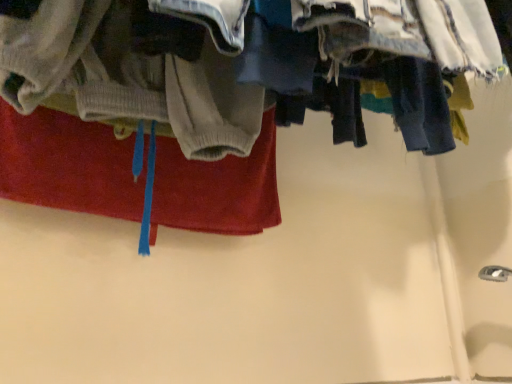
Question: Does denim fabric pants at upper right have a greater width compared to red cotton towel at upper left?

Choices:
 (A) no
 (B) yes

Answer: (B)

Question: Is denim fabric pants at upper right next to red cotton towel at upper left?

Choices:
 (A) yes
 (B) no

Answer: (B)

Question: Considering the relative positions of denim fabric pants at upper right and red cotton towel at upper left in the image provided, is denim fabric pants at upper right in front of red cotton towel at upper left?

Choices:
 (A) yes
 (B) no

Answer: (A)

Question: Does denim fabric pants at upper right have a smaller size compared to red cotton towel at upper left?

Choices:
 (A) no
 (B) yes

Answer: (A)

Question: Does denim fabric pants at upper right have a larger size compared to red cotton towel at upper left?

Choices:
 (A) yes
 (B) no

Answer: (A)

Question: From a real-world perspective, is denim fabric pants at upper right located higher than red cotton towel at upper left?

Choices:
 (A) yes
 (B) no

Answer: (A)

Question: From a real-world perspective, is red cotton towel at upper left under denim fabric pants at upper right?

Choices:
 (A) no
 (B) yes

Answer: (B)

Question: Is the depth of red cotton towel at upper left greater than that of denim fabric pants at upper right?

Choices:
 (A) yes
 (B) no

Answer: (A)

Question: Does red cotton towel at upper left appear on the left side of denim fabric pants at upper right?

Choices:
 (A) no
 (B) yes

Answer: (B)

Question: Can you confirm if red cotton towel at upper left is wider than denim fabric pants at upper right?

Choices:
 (A) yes
 (B) no

Answer: (B)

Question: Would you say denim fabric pants at upper right is part of red cotton towel at upper left's contents?

Choices:
 (A) yes
 (B) no

Answer: (B)

Question: Is red cotton towel at upper left far away from denim fabric pants at upper right?

Choices:
 (A) yes
 (B) no

Answer: (B)

Question: Choose the correct answer: Is denim fabric pants at upper right inside red cotton towel at upper left or outside it?

Choices:
 (A) inside
 (B) outside

Answer: (B)